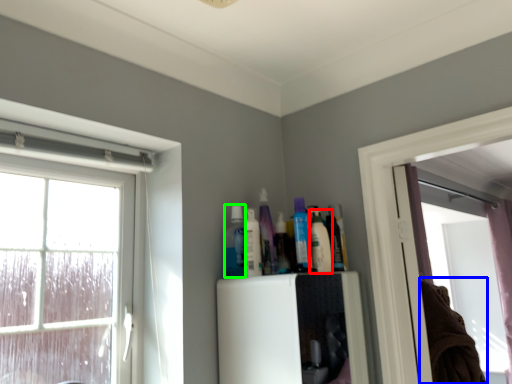
Question: Considering the real-world distances, which object is farthest from toiletry (highlighted by a red box)? laundry (highlighted by a blue box) or toiletry (highlighted by a green box)?

Choices:
 (A) laundry
 (B) toiletry

Answer: (A)